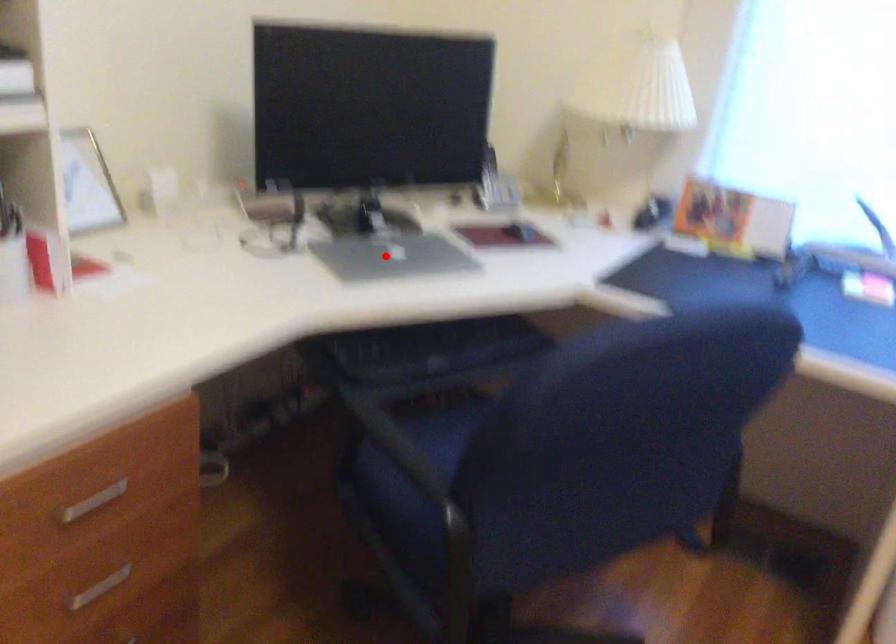
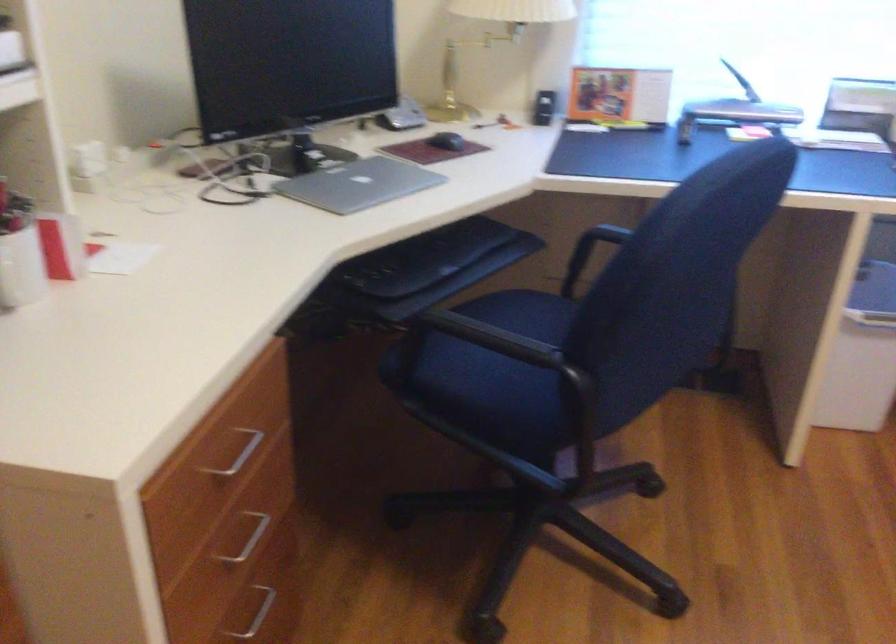
Where in the second image is the point corresponding to the highlighted location from the first image?

(358, 184)